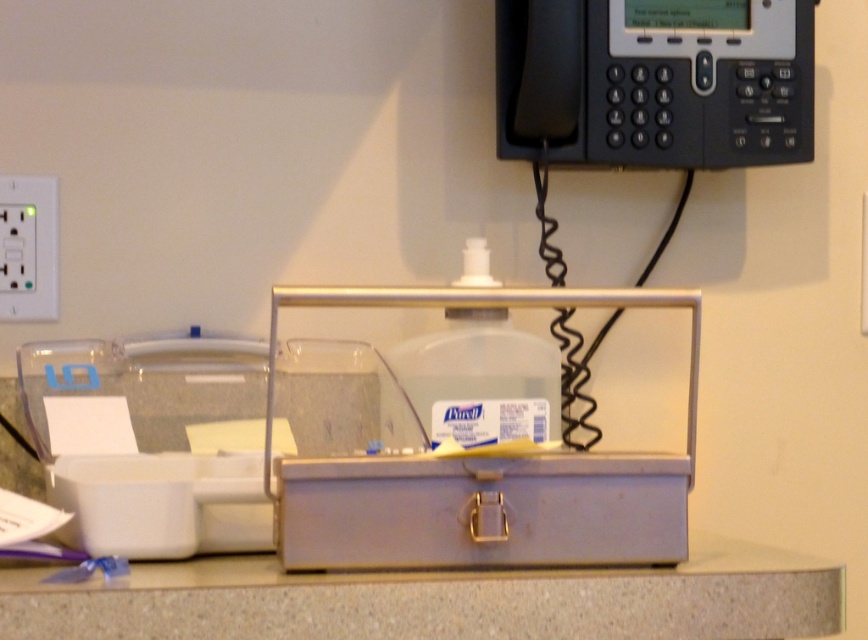
Is point (346, 618) in front of point (663, 61)?

Yes, point (346, 618) is closer to viewer.

The height and width of the screenshot is (640, 868). Identify the location of gray matte counter top at center. (437, 600).